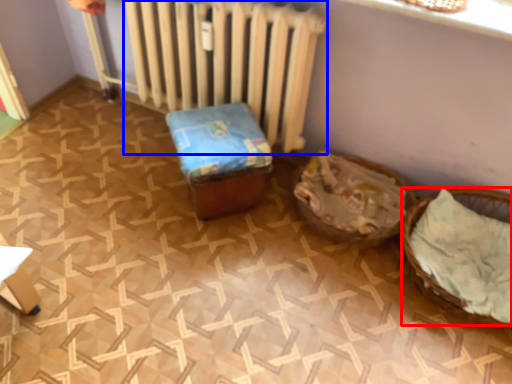
Question: Which of the following is the closest to the observer, basket (highlighted by a red box) or radiator (highlighted by a blue box)?

Choices:
 (A) basket
 (B) radiator

Answer: (A)